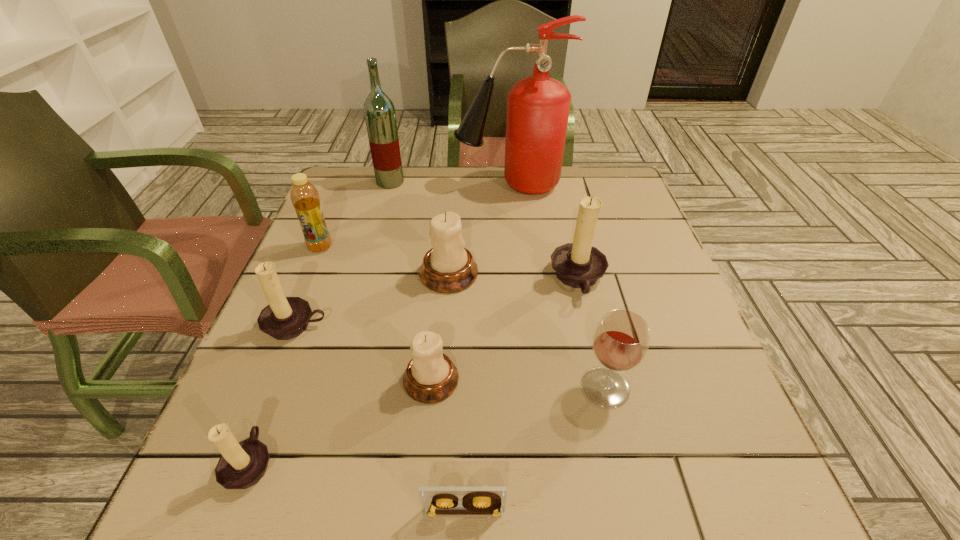
Where is `free space at the left edge of the desktop`? The height and width of the screenshot is (540, 960). free space at the left edge of the desktop is located at coordinates (282, 429).

Image resolution: width=960 pixels, height=540 pixels. In the image, there is a desktop. What are the coordinates of `free space at the right edge` in the screenshot? It's located at (641, 218).

Where is `vacant space at the far left corner of the desktop`? vacant space at the far left corner of the desktop is located at coordinates (347, 170).

The image size is (960, 540). In the image, there is a desktop. In order to click on blank space at the near left corner in this screenshot , I will do `click(189, 483)`.

This screenshot has width=960, height=540. In order to click on vacant space at the far right corner in this screenshot , I will do point(585,171).

Where is `free space at the near right corner`? free space at the near right corner is located at coordinates (769, 479).

Where is `blank region between the rightmost brown candle holder and the second farthest brown candle holder`? The width and height of the screenshot is (960, 540). blank region between the rightmost brown candle holder and the second farthest brown candle holder is located at coordinates (437, 302).

Image resolution: width=960 pixels, height=540 pixels. Find the location of `free spot between the nearest brown candle holder and the second nearest brown candle holder`. free spot between the nearest brown candle holder and the second nearest brown candle holder is located at coordinates (274, 394).

Identify the location of free point between the green liquor and the nearest brown candle holder. This screenshot has width=960, height=540. (321, 322).

Find the location of a particular element. free space between the green liquor and the rightmost brown candle holder is located at coordinates (484, 231).